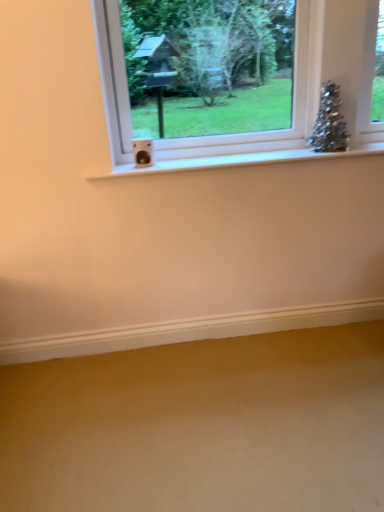
Question: In terms of width, does sparkly silver christmas tree at upper right look wider or thinner when compared to clear glass window at upper center?

Choices:
 (A) thin
 (B) wide

Answer: (A)

Question: Is point [331, 130] positioned closer to the camera than point [299, 32]?

Choices:
 (A) farther
 (B) closer

Answer: (A)

Question: From their relative heights in the image, would you say sparkly silver christmas tree at upper right is taller or shorter than clear glass window at upper center?

Choices:
 (A) tall
 (B) short

Answer: (B)

Question: Considering the positions of clear glass window at upper center and sparkly silver christmas tree at upper right in the image, is clear glass window at upper center wider or thinner than sparkly silver christmas tree at upper right?

Choices:
 (A) wide
 (B) thin

Answer: (A)

Question: In the image, is clear glass window at upper center on the left side or the right side of sparkly silver christmas tree at upper right?

Choices:
 (A) left
 (B) right

Answer: (A)

Question: Would you say clear glass window at upper center is inside or outside sparkly silver christmas tree at upper right?

Choices:
 (A) inside
 (B) outside

Answer: (B)

Question: Relative to sparkly silver christmas tree at upper right, is clear glass window at upper center in front or behind?

Choices:
 (A) behind
 (B) front

Answer: (B)